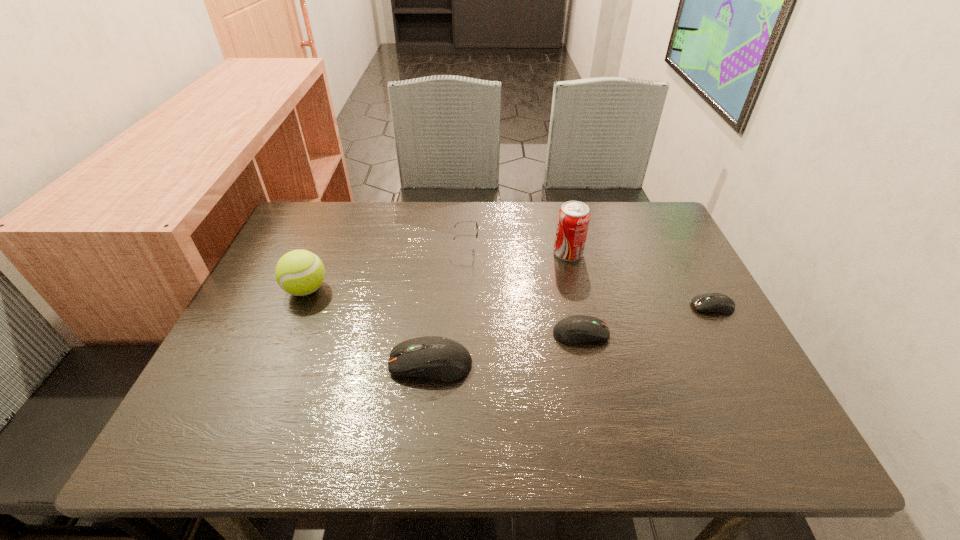
What are the coordinates of `sunglasses located in the far edge section of the desktop` in the screenshot? It's located at (466, 221).

What are the coordinates of `soda can situated at the far edge` in the screenshot? It's located at (573, 220).

Find the location of a particular element. object that is at the near edge is located at coordinates (440, 358).

Image resolution: width=960 pixels, height=540 pixels. What are the coordinates of `object at the left edge` in the screenshot? It's located at (299, 272).

Identify the location of object that is at the right edge. This screenshot has width=960, height=540. (719, 303).

The image size is (960, 540). In order to click on vacant space at the far edge in this screenshot , I will do `click(356, 226)`.

In order to click on free space at the near edge of the desktop in this screenshot , I will do coord(574,388).

Identify the location of vacant space at the left edge. (264, 351).

You are a GUI agent. You are given a task and a screenshot of the screen. Output one action in this format:
    pyautogui.click(x=<x>, y=<y>)
    Task: Click on the vacant space at the right edge of the desktop
    
    Given the screenshot: What is the action you would take?
    pyautogui.click(x=688, y=341)

The height and width of the screenshot is (540, 960). In order to click on vacant space at the far left corner in this screenshot , I will do `click(334, 213)`.